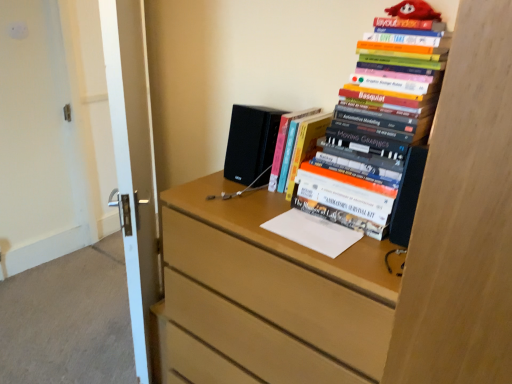
Locate an element on the screen. vacant space that is to the left of hardcover book at center, placed as the 1th book when sorted from left to right is located at coordinates (237, 195).